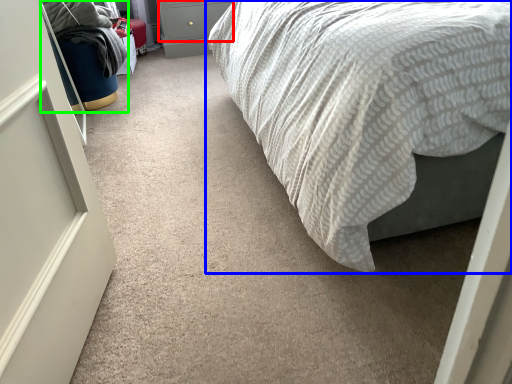
Question: Which is farther away from drawer (highlighted by a red box)? bed (highlighted by a blue box) or bean bag chair (highlighted by a green box)?

Choices:
 (A) bed
 (B) bean bag chair

Answer: (A)